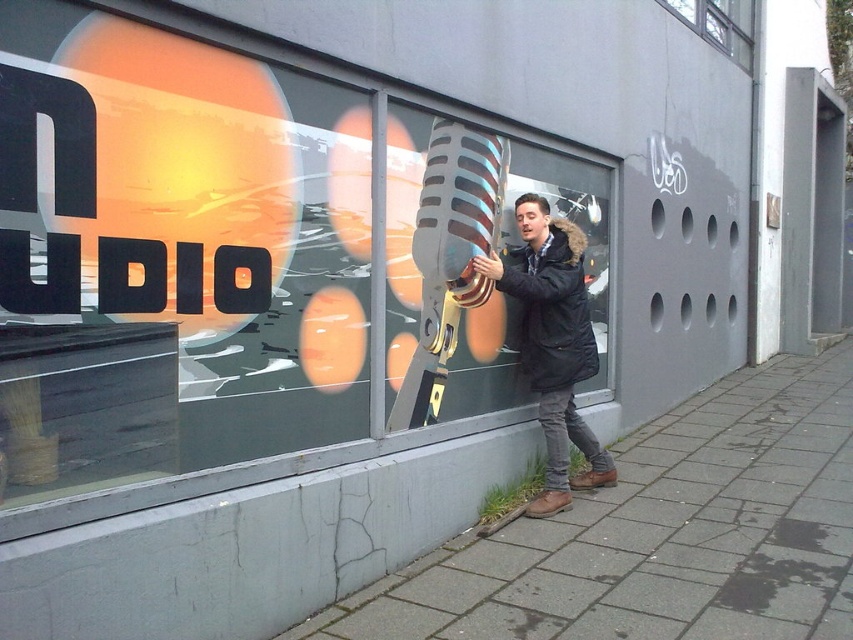
You are a photographer trying to capture a closeup of the gray concrete pavement at lower right while also including the black matte jacket at center in the frame. Based on their positions, will you need to adjust your camera angle upwards or downwards to include both?

The gray concrete pavement at lower right is closer to the viewer than the black matte jacket at center. To include both in the frame, you would need to adjust your camera angle upwards to capture the black matte jacket at center which is further away while keeping the gray concrete pavement at lower right in view.

You are standing at the point closest to the bottom left corner of the image. You want to walk towards the point labeled point (824, 474). Will you pass by point (752, 29) on your way there?

Yes, because point (824, 474) is in front of point (752, 29), so you will pass by point (752, 29) on your way there.

You are a photographer trying to capture the metallic glass microphone at center and the clear glass window at upper center in a single shot. Since the microphone is blocking part of the window, can you adjust your position to ensure both are fully visible without any obstruction?

The metallic glass microphone at center is in front of the clear glass window at upper center, so you can move your position slightly to the side to capture both objects without obstruction by adjusting the angle so the microphone no longer blocks the window.